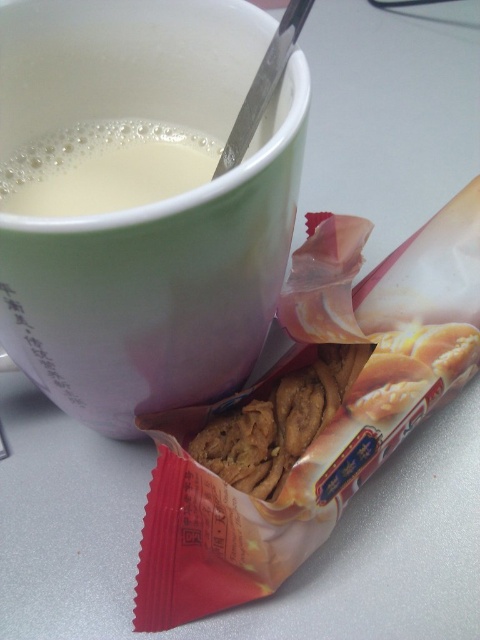
Question: Is matte ceramic mug at upper center smaller than white creamy liquid at upper left?

Choices:
 (A) yes
 (B) no

Answer: (B)

Question: Can you confirm if matte ceramic mug at upper center is bigger than white creamy liquid at upper left?

Choices:
 (A) yes
 (B) no

Answer: (A)

Question: Which object appears closest to the camera in this image?

Choices:
 (A) white creamy liquid at upper left
 (B) matte ceramic mug at upper center

Answer: (B)

Question: Is matte ceramic mug at upper center bigger than white creamy liquid at upper left?

Choices:
 (A) no
 (B) yes

Answer: (B)

Question: Which object appears farthest from the camera in this image?

Choices:
 (A) matte ceramic mug at upper center
 (B) white creamy liquid at upper left

Answer: (B)